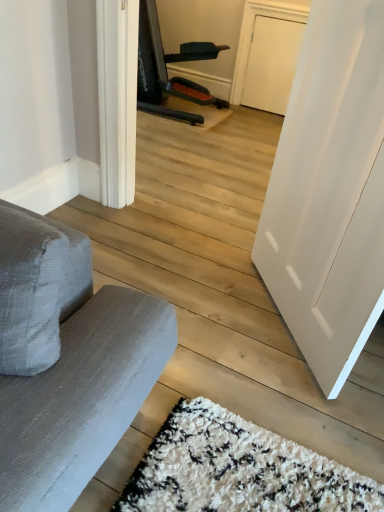
Locate an element on the screen. This screenshot has height=512, width=384. vacant space in front of white smooth door at right is located at coordinates (266, 414).